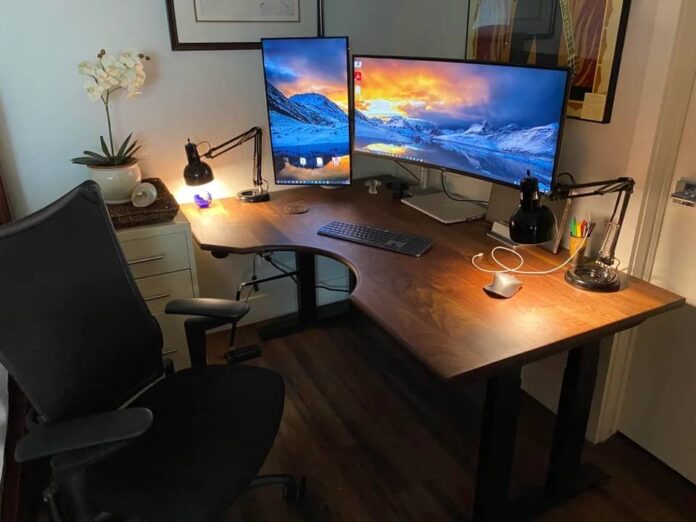
At what (x,y) coordinates should I click in order to perform the action: click on lamp base. Please return your answer as a coordinate pair (x, y). Looking at the image, I should click on (259, 195), (610, 284).